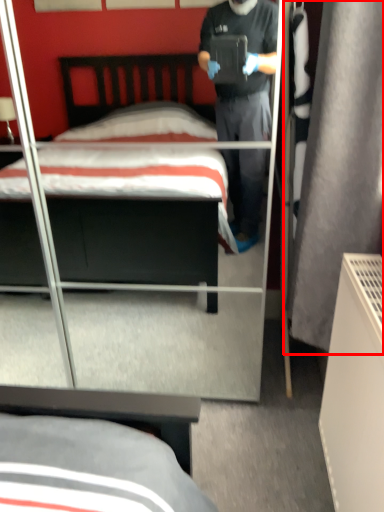
Question: From the image's perspective, where is curtain (annotated by the red box) located in relation to bed in the image?

Choices:
 (A) above
 (B) below

Answer: (B)